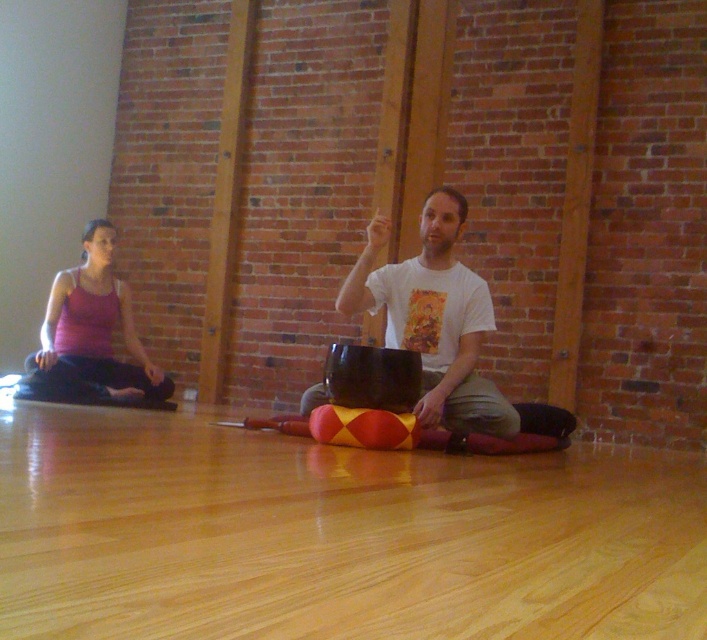
Does white matte t-shirt at center appear over matte pink tank top at left?

Actually, white matte t-shirt at center is below matte pink tank top at left.

Locate an element on the screen. The width and height of the screenshot is (707, 640). white matte t-shirt at center is located at coordinates (x=433, y=317).